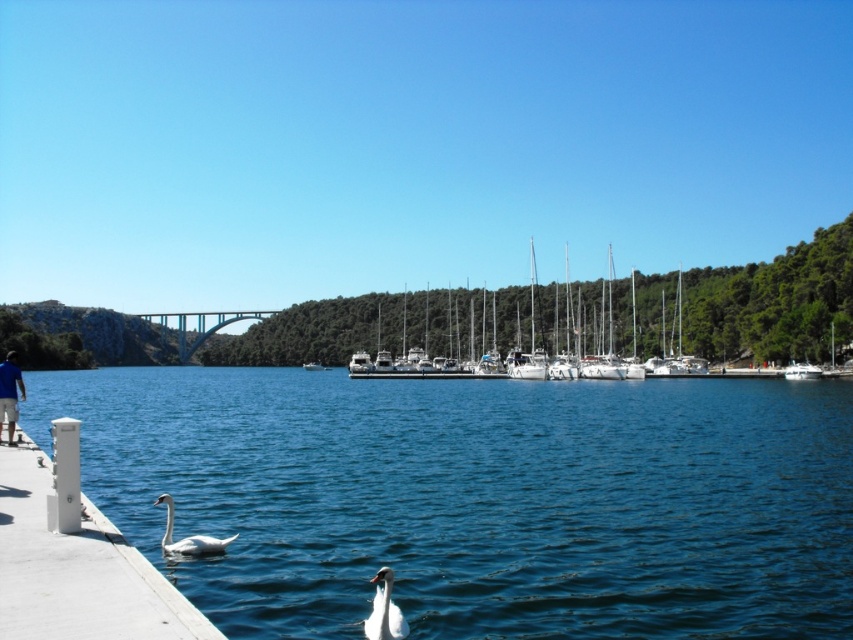
You are a photographer trying to capture the blue fabric shirt at lower left in your shot. Based on its position, where should you aim your camera?

The blue fabric shirt at lower left is located at the 2D coordinates point (9, 394), so you should aim your camera at that specific point to capture it.

You are standing on the dock and want to throw a small stone into the water near the white glossy swan at lower center. If you can throw a stone 100 feet, will you be able to reach the clear blue water at lower center from your current position?

The distance between the clear blue water at lower center and the white glossy swan at lower center is 128.03 feet. Since your throwing range is 100 feet, you cannot reach the clear blue water at lower center from your current position.